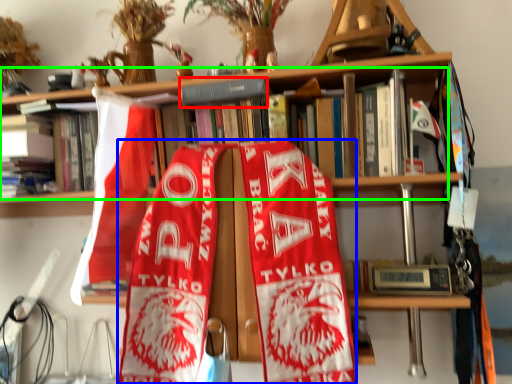
Question: Considering the real-world distances, which object is farthest from book (highlighted by a red box)? beach towel (highlighted by a blue box) or book (highlighted by a green box)?

Choices:
 (A) beach towel
 (B) book

Answer: (A)